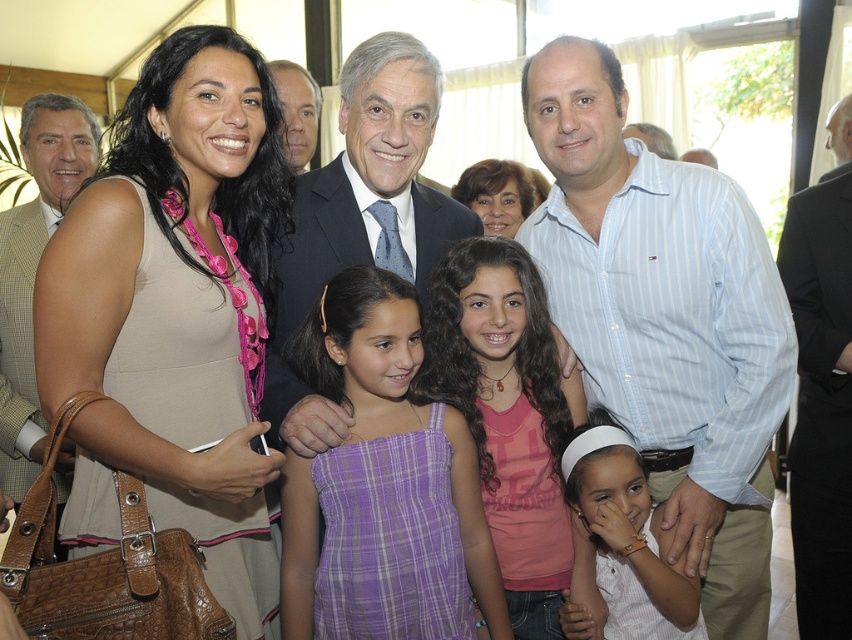
You are a photographer trying to adjust the lighting for a group photo. You notice the beige fabric dress at center and the white matte shirt at center. Which clothing item is covering part of the other?

The beige fabric dress at center is positioned over the white matte shirt at center, so it is covering part of it.